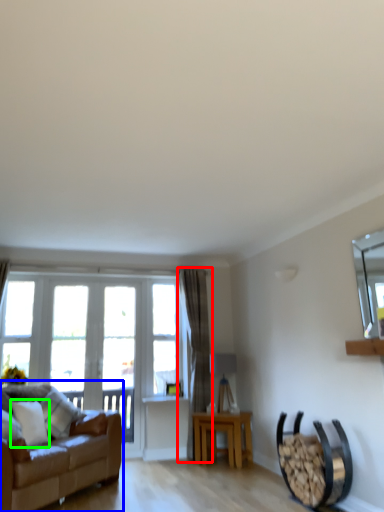
Question: Based on their relative distances, which object is farther from curtain (highlighted by a red box)? Choose from studio couch (highlighted by a blue box) and pillow (highlighted by a green box).

Choices:
 (A) studio couch
 (B) pillow

Answer: (B)